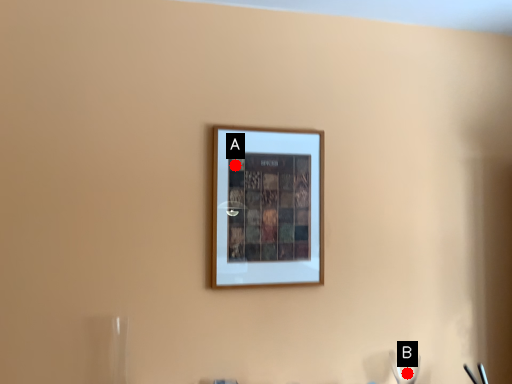
Question: Two points are circled on the image, labeled by A and B beside each circle. Which point is closer to the camera?

Choices:
 (A) A is closer
 (B) B is closer

Answer: (A)